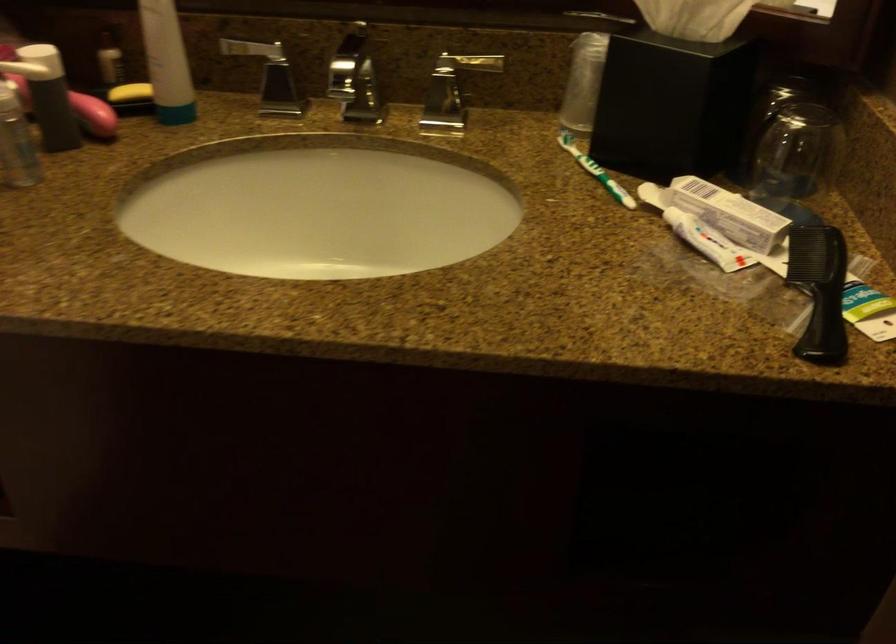
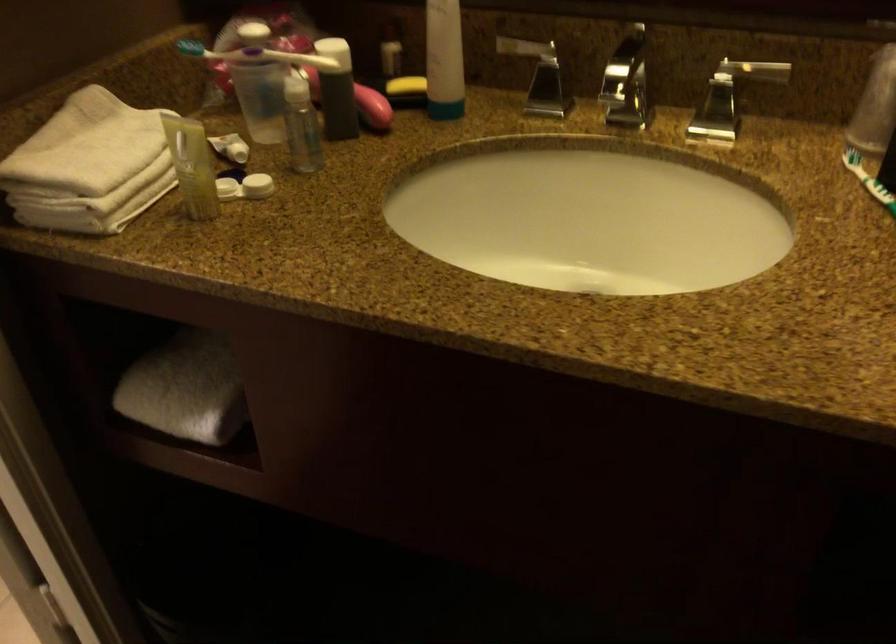
Question: Based on the continuous images, in which direction is the camera rotating? Reply with the corresponding letter.

Choices:
 (A) Left
 (B) Right
 (C) Up
 (D) Down

Answer: (A)